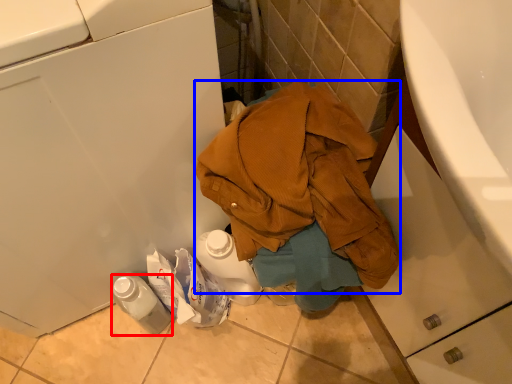
Question: Which object appears closest to the camera in this image, bottle (highlighted by a red box) or waste (highlighted by a blue box)?

Choices:
 (A) bottle
 (B) waste

Answer: (B)